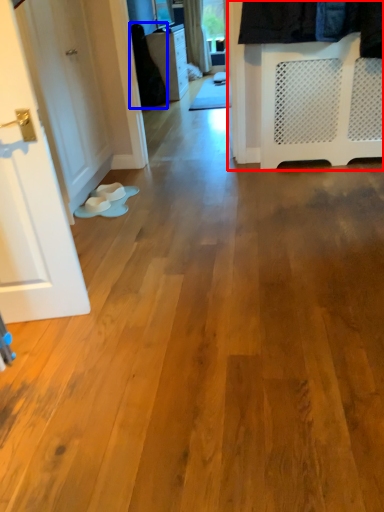
Question: Among these objects, which one is nearest to the camera, closet (highlighted by a red box) or clothing (highlighted by a blue box)?

Choices:
 (A) closet
 (B) clothing

Answer: (A)